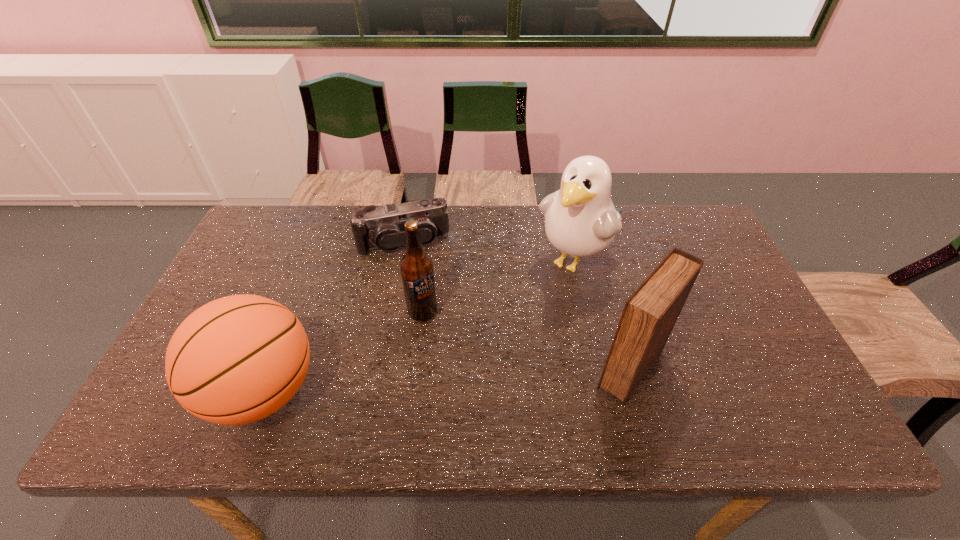
Identify the location of empty space that is in between the Bible and the beer bottle. Image resolution: width=960 pixels, height=540 pixels. (527, 340).

Find the location of a particular element. free space between the beer bottle and the basketball is located at coordinates (343, 352).

Locate an element on the screen. Image resolution: width=960 pixels, height=540 pixels. vacant space that is in between the basketball and the Bible is located at coordinates (447, 380).

I want to click on blank region between the Bible and the basketball, so click(447, 380).

The height and width of the screenshot is (540, 960). I want to click on free space between the camcorder and the Bible, so click(517, 306).

Locate an element on the screen. Image resolution: width=960 pixels, height=540 pixels. free space between the tallest object and the third farthest object is located at coordinates (499, 287).

Locate an element on the screen. the third closest object to the camcorder is located at coordinates (238, 359).

Point out which object is positioned as the fourth nearest to the basketball. Please provide its 2D coordinates. Your answer should be formatted as a tuple, i.e. [(x, y)], where the tuple contains the x and y coordinates of a point satisfying the conditions above.

[(650, 313)]

Where is `blank space that satisfies the following two spatial constraints: 1. on the front side of the third nearest object; 2. on the left side of the shortest object`? This screenshot has height=540, width=960. blank space that satisfies the following two spatial constraints: 1. on the front side of the third nearest object; 2. on the left side of the shortest object is located at coordinates (390, 312).

Locate an element on the screen. This screenshot has width=960, height=540. blank space that satisfies the following two spatial constraints: 1. on the back side of the camcorder; 2. on the left side of the basketball is located at coordinates pyautogui.click(x=322, y=243).